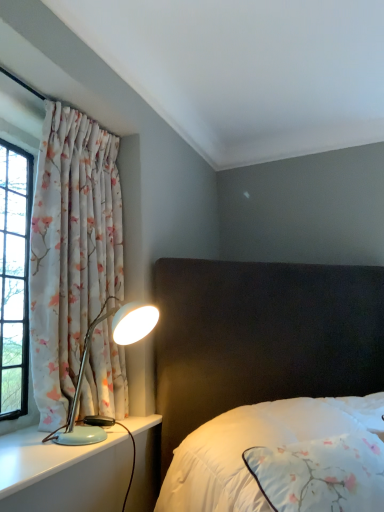
Question: Is light blue plastic lamp at left at the right side of floral fabric curtain at left?

Choices:
 (A) yes
 (B) no

Answer: (A)

Question: Does light blue plastic lamp at left appear on the left side of floral fabric curtain at left?

Choices:
 (A) no
 (B) yes

Answer: (A)

Question: Can you confirm if light blue plastic lamp at left is smaller than floral fabric curtain at left?

Choices:
 (A) no
 (B) yes

Answer: (B)

Question: From a real-world perspective, is light blue plastic lamp at left located beneath floral fabric curtain at left?

Choices:
 (A) no
 (B) yes

Answer: (B)

Question: Is light blue plastic lamp at left surrounding floral fabric curtain at left?

Choices:
 (A) no
 (B) yes

Answer: (A)

Question: From a real-world perspective, is white satin bed at center physically located above or below light blue plastic lamp at left?

Choices:
 (A) below
 (B) above

Answer: (A)

Question: Which is correct: white satin bed at center is inside light blue plastic lamp at left, or outside of it?

Choices:
 (A) outside
 (B) inside

Answer: (A)

Question: Is white satin bed at center wider or thinner than light blue plastic lamp at left?

Choices:
 (A) thin
 (B) wide

Answer: (B)

Question: From the image's perspective, is white satin bed at center above or below light blue plastic lamp at left?

Choices:
 (A) below
 (B) above

Answer: (A)

Question: In terms of size, does floral fabric curtain at left appear bigger or smaller than white satin bed at center?

Choices:
 (A) big
 (B) small

Answer: (B)

Question: Based on their positions, is floral fabric curtain at left located to the left or right of white satin bed at center?

Choices:
 (A) right
 (B) left

Answer: (B)

Question: Would you say floral fabric curtain at left is inside or outside white satin bed at center?

Choices:
 (A) inside
 (B) outside

Answer: (B)

Question: In terms of width, does floral fabric curtain at left look wider or thinner when compared to white satin bed at center?

Choices:
 (A) thin
 (B) wide

Answer: (A)

Question: Is point (248, 443) positioned closer to the camera than point (115, 359)?

Choices:
 (A) farther
 (B) closer

Answer: (B)

Question: Considering the positions of white satin bed at center and floral fabric curtain at left in the image, is white satin bed at center bigger or smaller than floral fabric curtain at left?

Choices:
 (A) big
 (B) small

Answer: (A)